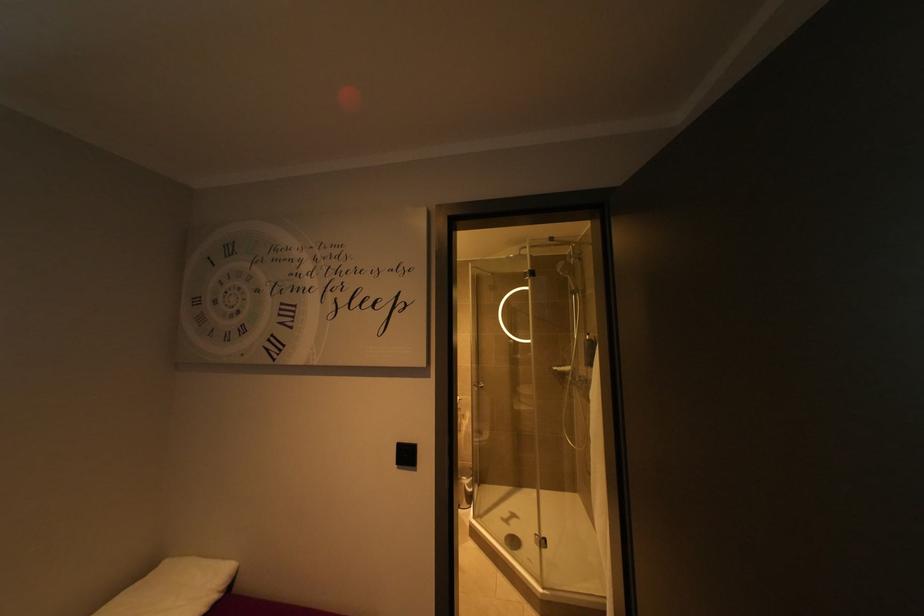
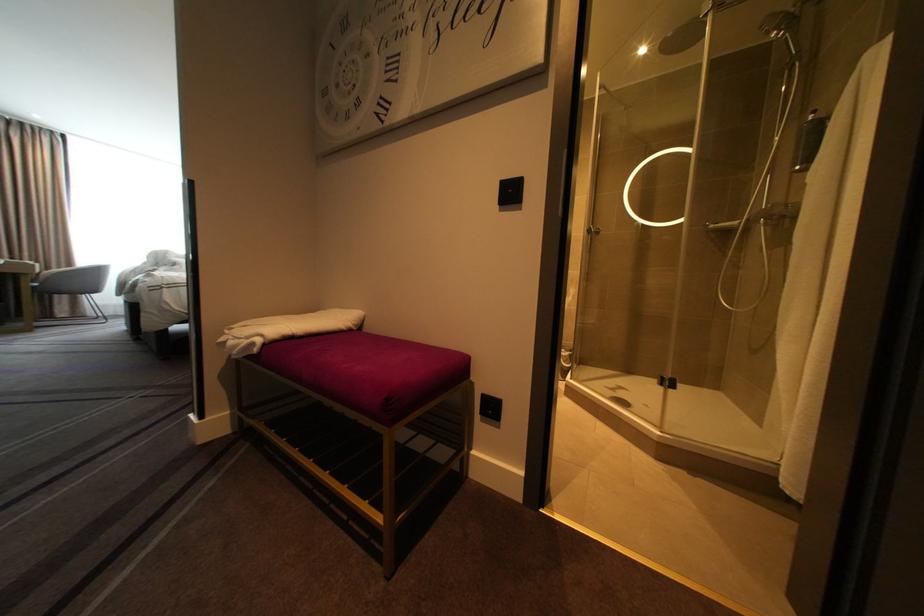
Question: The first image is from the beginning of the video and the second image is from the end. How did the camera likely rotate when shooting the video?

Choices:
 (A) Left
 (B) Right
 (C) Up
 (D) Down

Answer: (A)